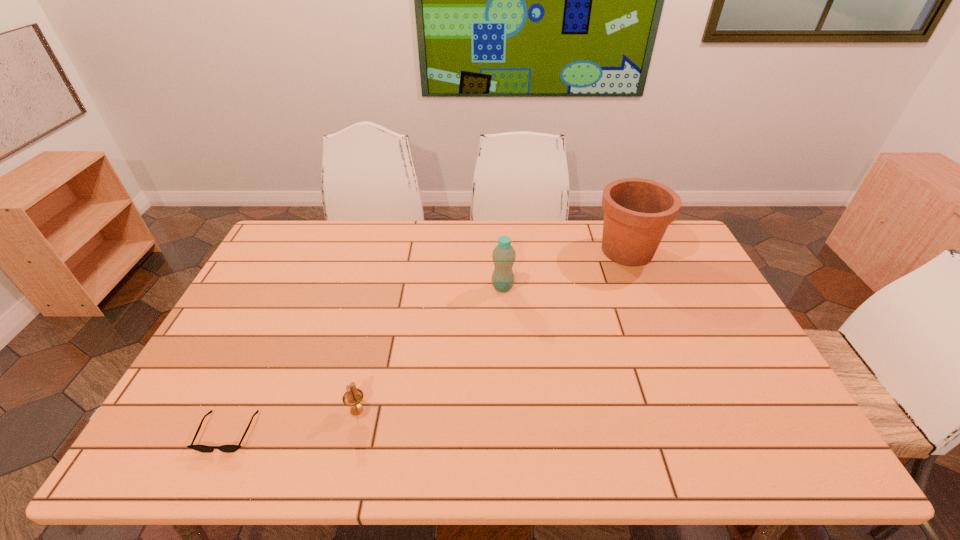
Find the location of a particular element. The image size is (960, 540). vacant space located 0.380m at the front cap of the water bottle is located at coordinates (372, 287).

Find the location of `vacant region located at the front cap of the water bottle`. vacant region located at the front cap of the water bottle is located at coordinates (467, 287).

Identify the location of free region located 0.100m on the right of the third tallest object. This screenshot has width=960, height=540. (409, 410).

Where is `object at the far edge`? The width and height of the screenshot is (960, 540). object at the far edge is located at coordinates (637, 212).

This screenshot has width=960, height=540. Find the location of `object that is at the near edge`. object that is at the near edge is located at coordinates (201, 448).

I want to click on object present at the left edge, so click(x=201, y=448).

I want to click on object at the right edge, so click(637, 212).

You are a GUI agent. You are given a task and a screenshot of the screen. Output one action in this format:
    pyautogui.click(x=<x>, y=<y>)
    Task: Click on the object located at the near left corner
    This screenshot has width=960, height=540.
    Given the screenshot: What is the action you would take?
    pyautogui.click(x=201, y=448)

Where is `object that is at the far right corner`? This screenshot has height=540, width=960. object that is at the far right corner is located at coordinates (637, 212).

At what (x,y) coordinates should I click in order to perform the action: click on vacant space at the far edge. Please return your answer as a coordinate pair (x, y). Looking at the image, I should click on (551, 235).